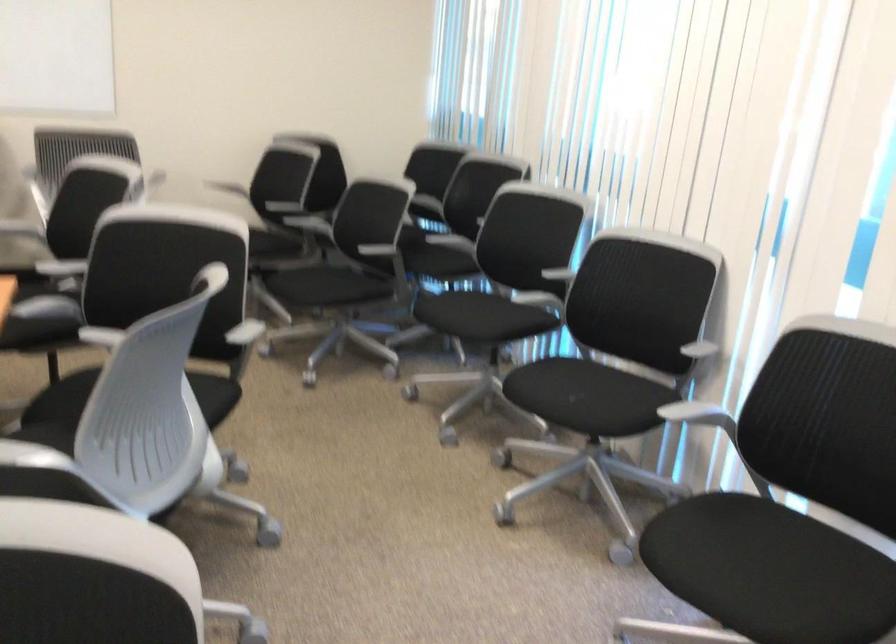
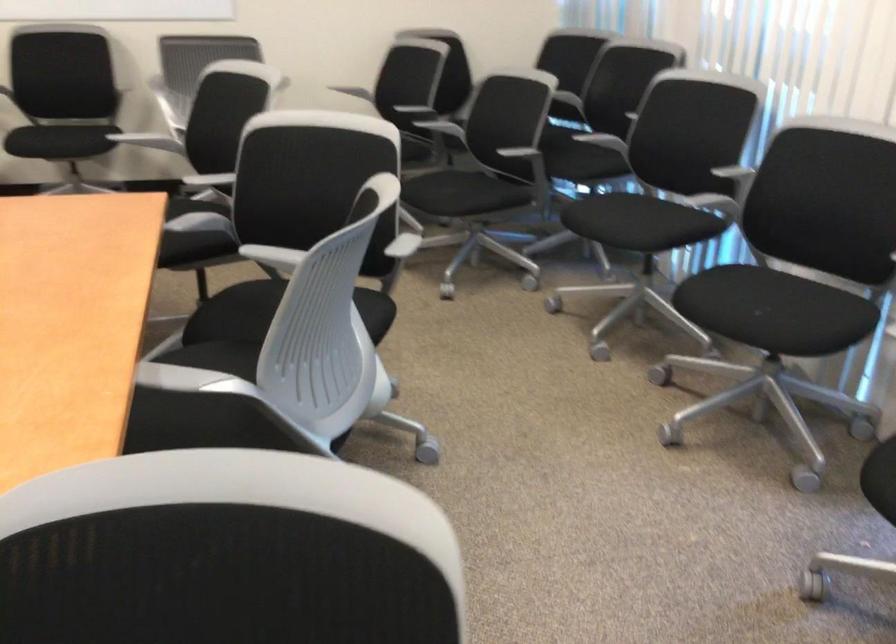
The point at (445, 251) is marked in the first image. Where is the corresponding point in the second image?

(588, 147)